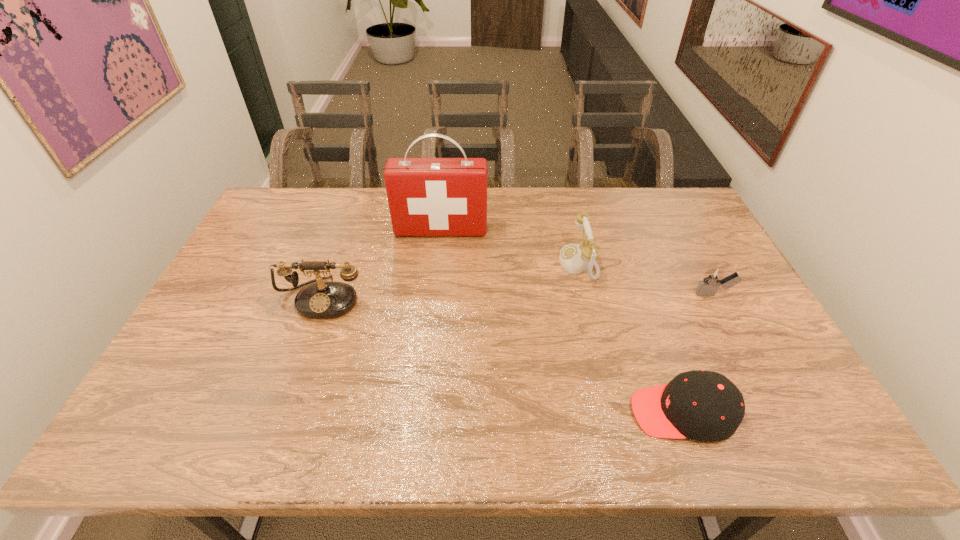
Locate an element on the screen. The height and width of the screenshot is (540, 960). free space located on the dial of the third tallest object is located at coordinates (444, 264).

Identify the location of blank space located on the dial of the third tallest object. This screenshot has height=540, width=960. (486, 264).

You are a GUI agent. You are given a task and a screenshot of the screen. Output one action in this format:
    pyautogui.click(x=<x>, y=<y>)
    Task: Click on the vacant region located on the back of the igniter
    
    Given the screenshot: What is the action you would take?
    pyautogui.click(x=680, y=229)

Locate an element on the screen. This screenshot has height=540, width=960. vacant space located 0.130m on the front-facing side of the cap is located at coordinates (575, 413).

This screenshot has height=540, width=960. I want to click on vacant area situated 0.260m on the front-facing side of the cap, so click(x=518, y=413).

This screenshot has width=960, height=540. Identify the location of vacant space located on the front-facing side of the cap. (588, 413).

The height and width of the screenshot is (540, 960). Identify the location of object that is at the far edge. (426, 196).

Locate an element on the screen. object located in the near edge section of the desktop is located at coordinates (706, 406).

Where is `object present at the right edge`? Image resolution: width=960 pixels, height=540 pixels. object present at the right edge is located at coordinates (712, 279).

Where is `vacant space at the far edge of the desktop`? The height and width of the screenshot is (540, 960). vacant space at the far edge of the desktop is located at coordinates (372, 208).